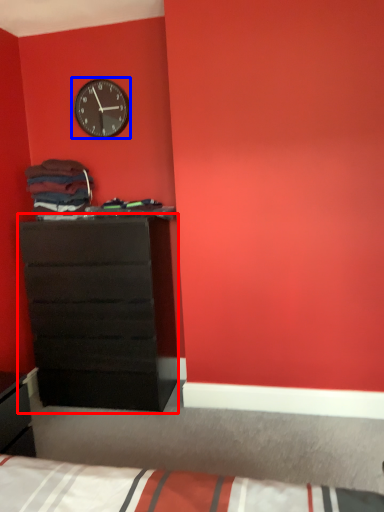
Question: Among these objects, which one is farthest to the camera, chest of drawers (highlighted by a red box) or wall clock (highlighted by a blue box)?

Choices:
 (A) chest of drawers
 (B) wall clock

Answer: (B)